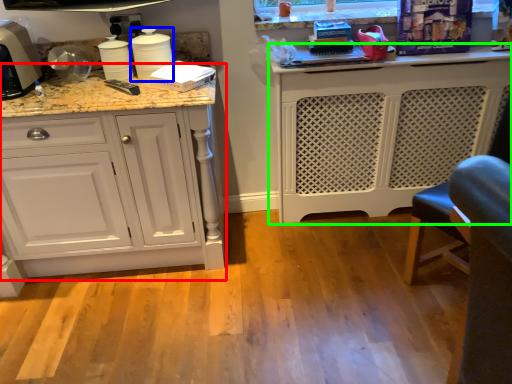
Question: Which object is the closest to the cabinetry (highlighted by a red box)? Choose among these: appliance (highlighted by a blue box) or cabinetry (highlighted by a green box).

Choices:
 (A) appliance
 (B) cabinetry

Answer: (A)